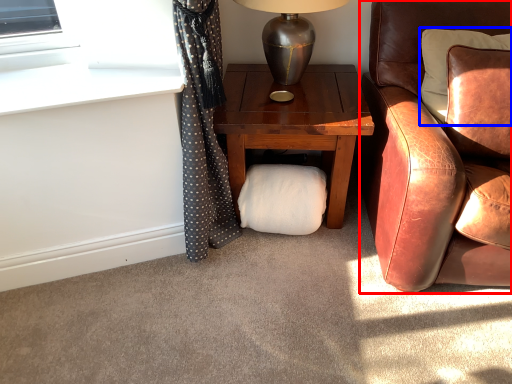
Question: Among these objects, which one is farthest to the camera, chair (highlighted by a red box) or pillow (highlighted by a blue box)?

Choices:
 (A) chair
 (B) pillow

Answer: (B)